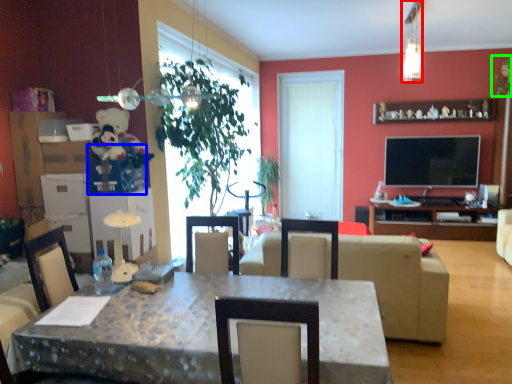
Question: Based on their relative distances, which object is farther from lamp (highlighted by a red box)? Choose from box (highlighted by a blue box) and plant (highlighted by a green box).

Choices:
 (A) box
 (B) plant

Answer: (A)